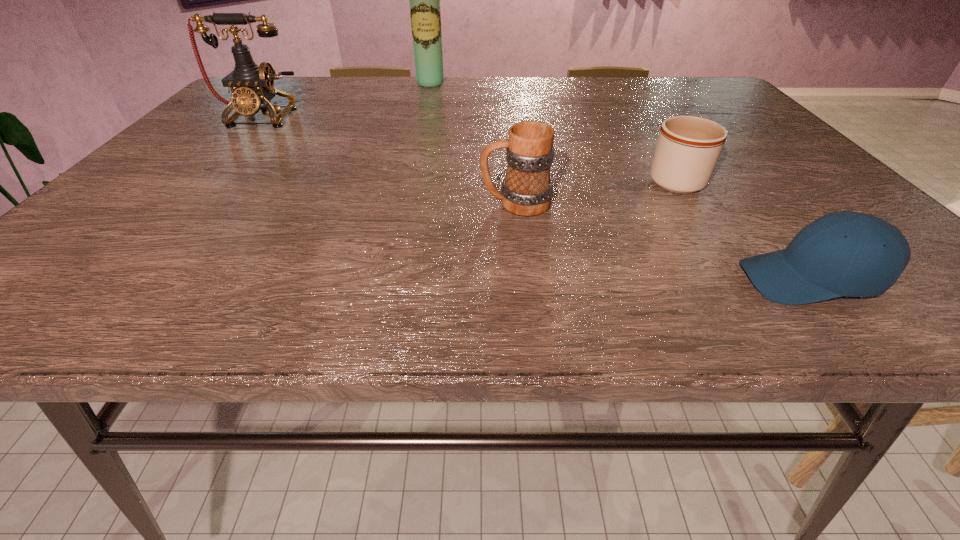
You are a GUI agent. You are given a task and a screenshot of the screen. Output one action in this format:
    pyautogui.click(x=<x>, y=<y>)
    Task: Click on the wine bottle
    Image resolution: width=960 pixels, height=540 pixels.
    Given the screenshot: What is the action you would take?
    pyautogui.click(x=424, y=0)

The image size is (960, 540). Find the location of `the farthest object`. the farthest object is located at coordinates (424, 0).

I want to click on the second tallest object, so click(252, 85).

Identify the location of telephone. click(252, 85).

The image size is (960, 540). What are the coordinates of `the taller mug` in the screenshot? It's located at (526, 190).

You are a GUI agent. You are given a task and a screenshot of the screen. Output one action in this format:
    pyautogui.click(x=<x>, y=<y>)
    Task: Click on the left mug
    
    Given the screenshot: What is the action you would take?
    pyautogui.click(x=526, y=190)

This screenshot has width=960, height=540. I want to click on the shorter mug, so click(x=688, y=147).

The height and width of the screenshot is (540, 960). I want to click on baseball cap, so click(x=846, y=253).

Where is `vacant region located 0.210m on the front-facing side of the wine bottle`? vacant region located 0.210m on the front-facing side of the wine bottle is located at coordinates (422, 116).

Locate an element on the screen. This screenshot has height=540, width=960. free space located on the front of the second farthest object, featuring the rotary dial is located at coordinates (221, 160).